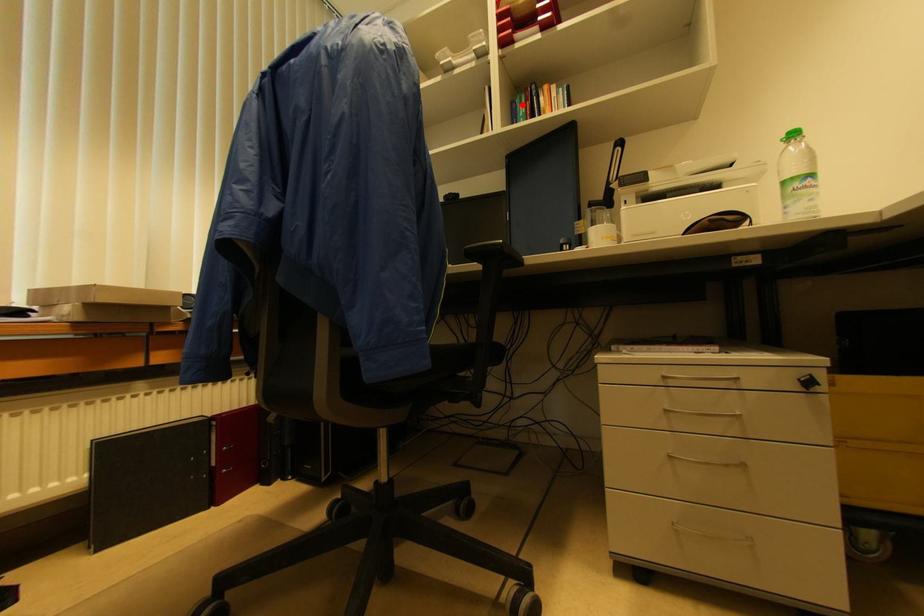
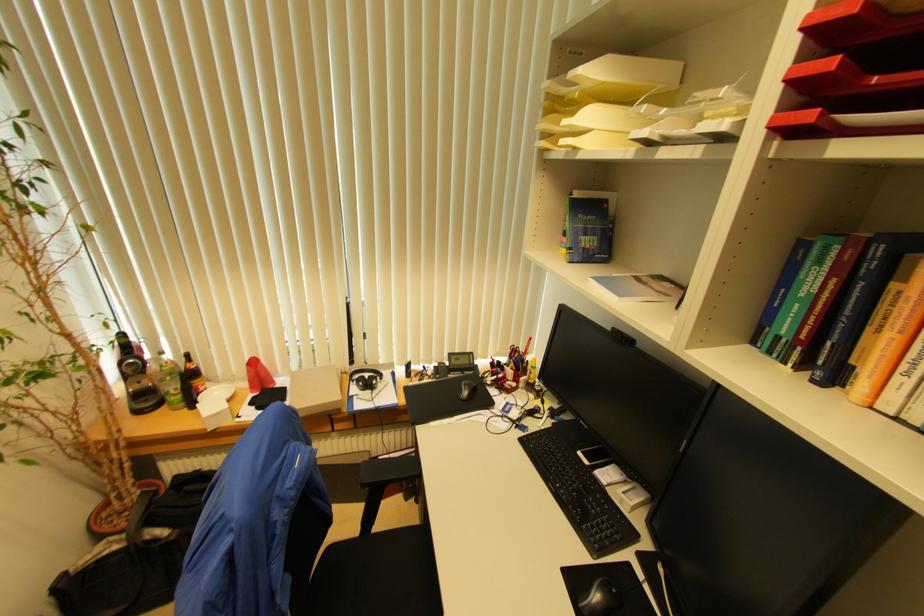
Question: I am providing you with two images of the same scene from different viewpoints. A red point is marked on the first image. Is the red point's position out of view in image 2?

Choices:
 (A) Yes
 (B) No

Answer: (B)